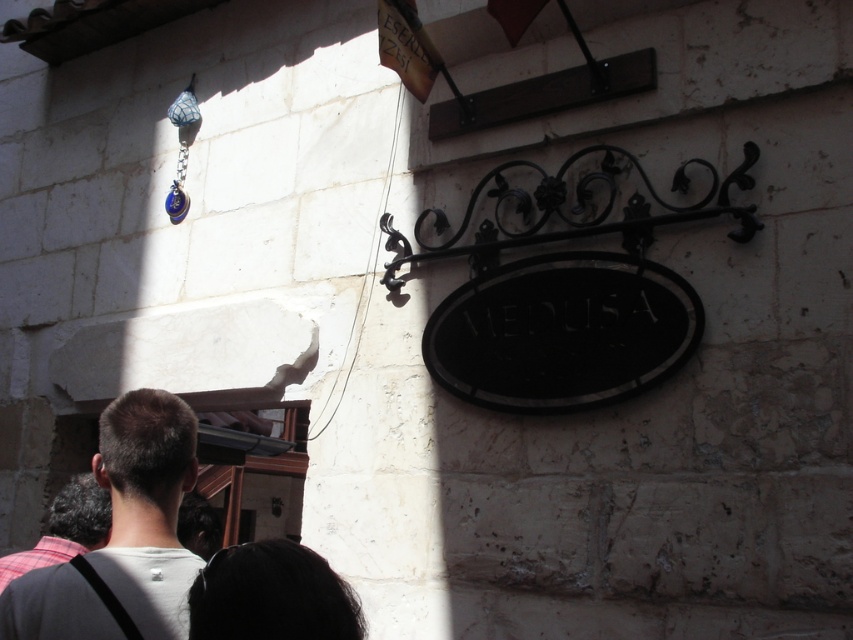
Which is below, black hair at lower center or plaid fabric shirt at lower left?

plaid fabric shirt at lower left is below.

In the scene shown: Between black hair at lower center and plaid fabric shirt at lower left, which one appears on the left side from the viewer's perspective?

plaid fabric shirt at lower left

Is point (321, 564) in front of point (49, 545)?

Yes.

You are a GUI agent. You are given a task and a screenshot of the screen. Output one action in this format:
    pyautogui.click(x=<x>, y=<y>)
    Task: Click on the black hair at lower center
    The height and width of the screenshot is (640, 853).
    Given the screenshot: What is the action you would take?
    pyautogui.click(x=271, y=595)

Is point (184, 550) less distant than point (9, 557)?

Yes.

From the picture: Can you confirm if white matte shirt at lower left is thinner than plaid fabric shirt at lower left?

No, white matte shirt at lower left is not thinner than plaid fabric shirt at lower left.

Is point (61, 593) positioned after point (84, 515)?

No, (61, 593) is closer to viewer.

Identify the location of white matte shirt at lower left. This screenshot has width=853, height=640. (148, 508).

Is point (183, 584) positioned behind point (259, 627)?

Yes, it is.

Does white matte shirt at lower left appear on the right side of black hair at lower center?

No, white matte shirt at lower left is not to the right of black hair at lower center.

You are a GUI agent. You are given a task and a screenshot of the screen. Output one action in this format:
    pyautogui.click(x=<x>, y=<y>)
    Task: Click on the white matte shirt at lower left
    
    Given the screenshot: What is the action you would take?
    pyautogui.click(x=148, y=508)